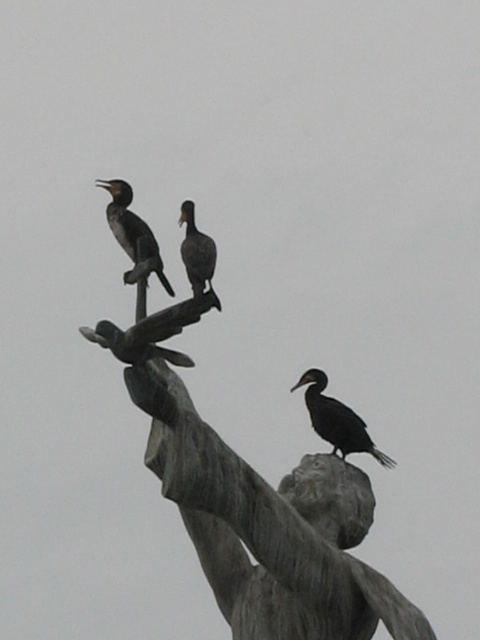
Question: Is bronze statue at upper center above dark gray feathers at center?

Choices:
 (A) yes
 (B) no

Answer: (B)

Question: Which point is closer to the camera?

Choices:
 (A) (122, 280)
 (B) (204, 276)

Answer: (A)

Question: Can you confirm if dark gray feathers at upper center is thinner than dark gray feathers at center?

Choices:
 (A) yes
 (B) no

Answer: (B)

Question: Which point is farther from the camera taking this photo?

Choices:
 (A) (131, 248)
 (B) (148, 246)
 (C) (315, 403)
 (D) (192, 224)

Answer: (C)

Question: Which of the following is the farthest from the observer?

Choices:
 (A) bronze statue at upper center
 (B) dark gray feathers at center
 (C) black matte bird at center

Answer: (C)

Question: Can you confirm if dark gray feathers at upper center is bigger than dark gray feathers at center?

Choices:
 (A) no
 (B) yes

Answer: (B)